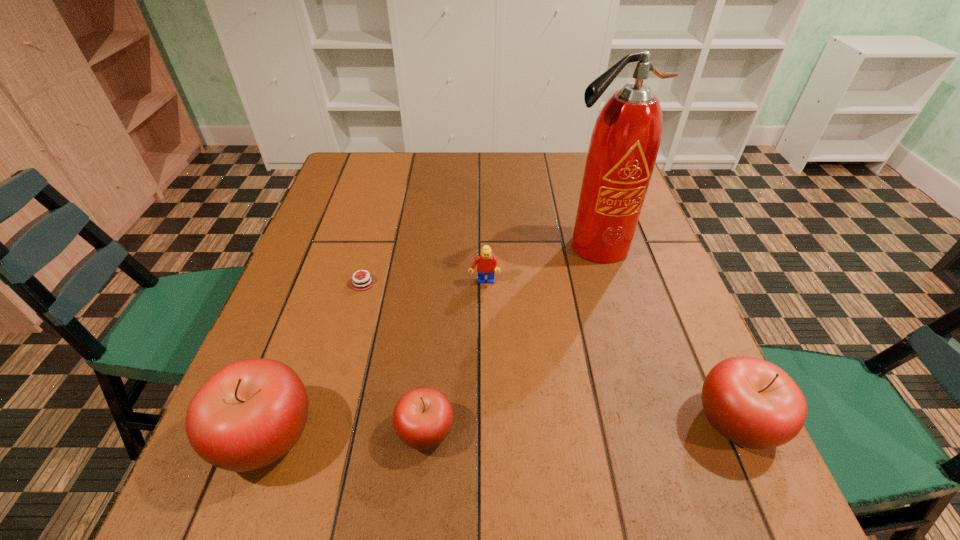
Where is `the leftmost apple`? This screenshot has width=960, height=540. the leftmost apple is located at coordinates (250, 413).

Find the location of a particular element. the third object from left to right is located at coordinates (423, 417).

The image size is (960, 540). In order to click on the shortest apple in this screenshot , I will do `click(423, 417)`.

Locate an element on the screen. This screenshot has height=540, width=960. the second tallest apple is located at coordinates (754, 403).

The height and width of the screenshot is (540, 960). Find the location of `the rightmost apple`. the rightmost apple is located at coordinates (754, 403).

This screenshot has width=960, height=540. In order to click on Lego in this screenshot , I will do coord(487,265).

Find the location of `the tallest object`. the tallest object is located at coordinates (624, 144).

Where is `the shortest object`? the shortest object is located at coordinates (366, 281).

Find the location of `vacant space located 0.120m on the right of the leftmost apple`. vacant space located 0.120m on the right of the leftmost apple is located at coordinates (387, 435).

At what (x,y) coordinates should I click in order to perform the action: click on free location located on the left of the shortest apple. Please return your answer as a coordinate pair (x, y). Image resolution: width=960 pixels, height=540 pixels. Looking at the image, I should click on (259, 430).